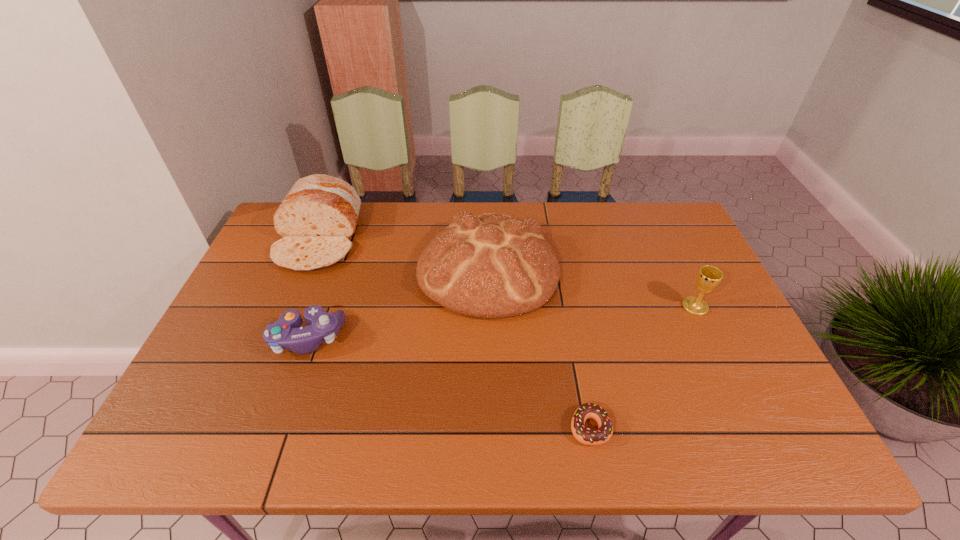
Image resolution: width=960 pixels, height=540 pixels. In order to click on empty space between the nearest object and the left bread in this screenshot , I will do `click(454, 333)`.

Find the location of `the closest object to the right bread`. the closest object to the right bread is located at coordinates (285, 334).

Identify the location of object that stands as the second closest to the shortest object. The width and height of the screenshot is (960, 540). pos(708,278).

Locate an element on the screen. The height and width of the screenshot is (540, 960). vacant position in the image that satisfies the following two spatial constraints: 1. on the back side of the control; 2. on the right side of the right bread is located at coordinates (331, 269).

You are a GUI agent. You are given a task and a screenshot of the screen. Output one action in this format:
    pyautogui.click(x=<x>, y=<y>)
    Task: Click on the free space that satisfies the following two spatial constraints: 1. at the sliced end of the left bread; 2. on the left side of the doughnut
    
    Given the screenshot: What is the action you would take?
    pyautogui.click(x=241, y=428)